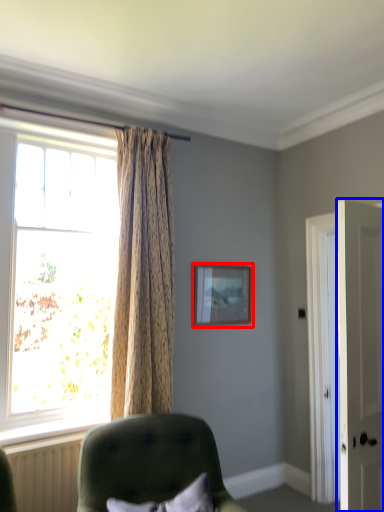
Question: Which of the following is the closest to the observer, picture frame (highlighted by a red box) or door (highlighted by a blue box)?

Choices:
 (A) picture frame
 (B) door

Answer: (B)